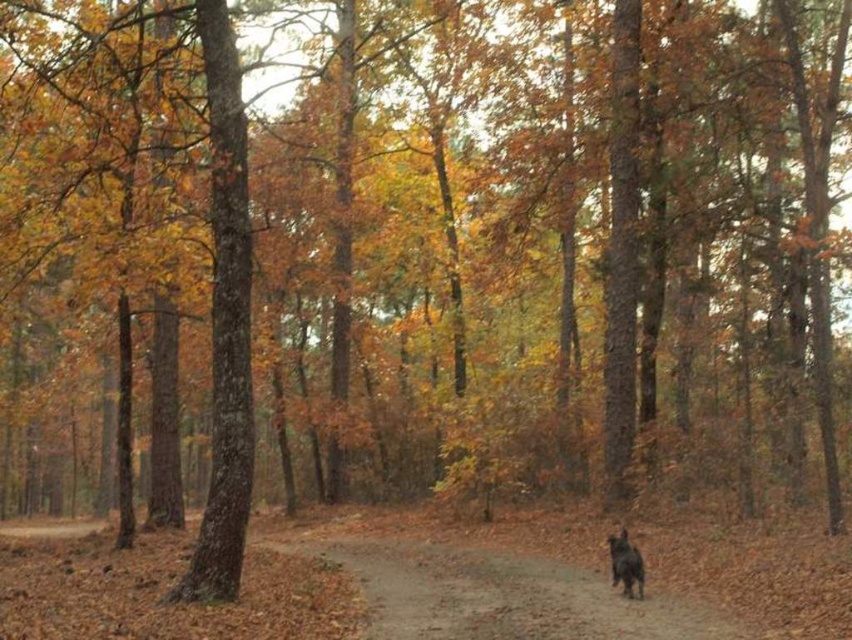
Question: Is brown dirt path at center to the right of black furry dog at lower right from the viewer's perspective?

Choices:
 (A) yes
 (B) no

Answer: (B)

Question: Which of the following is the closest to the observer?

Choices:
 (A) black furry dog at lower right
 (B) brown dirt path at center

Answer: (B)

Question: Is brown dirt path at center bigger than black furry dog at lower right?

Choices:
 (A) yes
 (B) no

Answer: (A)

Question: Does brown dirt path at center appear over black furry dog at lower right?

Choices:
 (A) yes
 (B) no

Answer: (B)

Question: Which object is farther from the camera taking this photo?

Choices:
 (A) brown dirt path at center
 (B) black furry dog at lower right

Answer: (B)